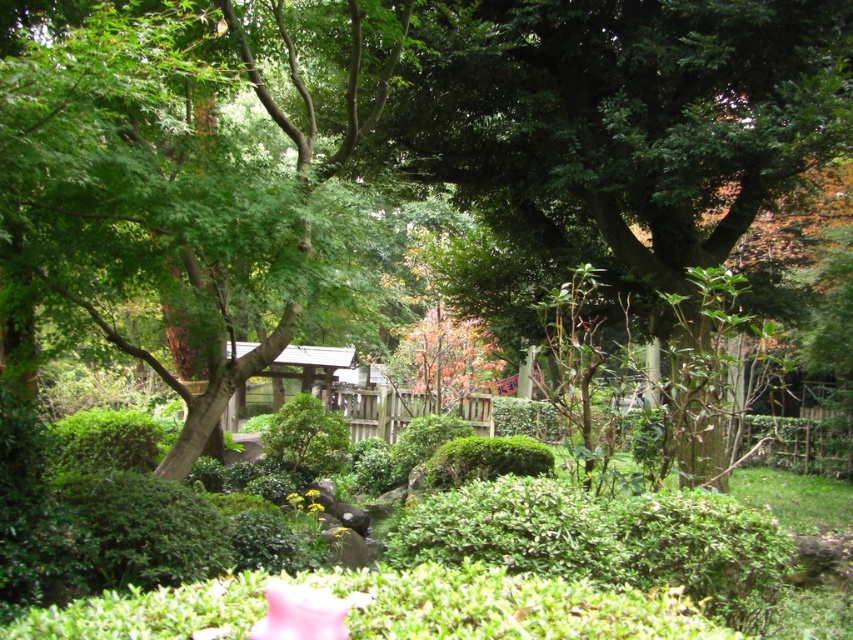
Question: Estimate the real-world distances between objects in this image. Which object is closer to the green leafy tree at center?

Choices:
 (A) green leafy bush at center
 (B) green leafy hedge at center

Answer: (B)

Question: Can you confirm if green leafy bush at center is thinner than green leafy hedge at center?

Choices:
 (A) no
 (B) yes

Answer: (B)

Question: In this image, where is green leafy tree at center located relative to green leafy bush at center?

Choices:
 (A) left
 (B) right

Answer: (A)

Question: Which point appears farthest from the camera in this image?

Choices:
 (A) (300, 406)
 (B) (445, 461)

Answer: (A)

Question: Can you confirm if green leafy tree at center is positioned above green leafy hedge at center?

Choices:
 (A) no
 (B) yes

Answer: (B)

Question: Which point is farther from the camera taking this photo?

Choices:
 (A) (265, 440)
 (B) (53, 99)

Answer: (A)